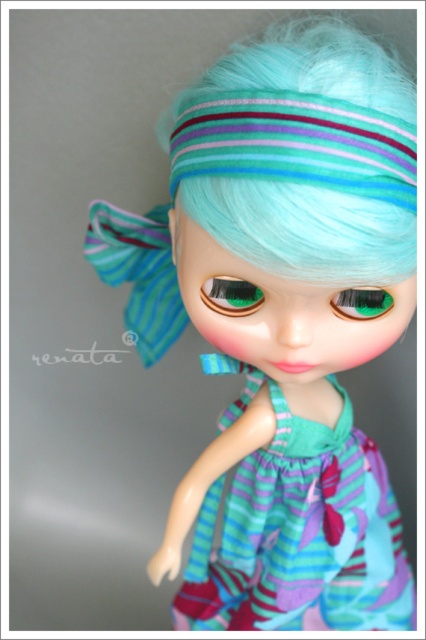
Question: Which object is farther from the camera taking this photo?

Choices:
 (A) teal striped fabric dress at center
 (B) striped fabric headband at upper center

Answer: (A)

Question: From the image, what is the correct spatial relationship of teal striped fabric dress at center in relation to striped fabric headband at upper center?

Choices:
 (A) right
 (B) left

Answer: (A)

Question: Considering the relative positions of teal striped fabric dress at center and striped fabric headband at upper center in the image provided, where is teal striped fabric dress at center located with respect to striped fabric headband at upper center?

Choices:
 (A) right
 (B) left

Answer: (A)

Question: Considering the relative positions of teal striped fabric dress at center and striped fabric headband at upper center in the image provided, where is teal striped fabric dress at center located with respect to striped fabric headband at upper center?

Choices:
 (A) left
 (B) right

Answer: (B)

Question: Which object appears farthest from the camera in this image?

Choices:
 (A) striped fabric headband at upper center
 (B) teal striped fabric dress at center

Answer: (B)